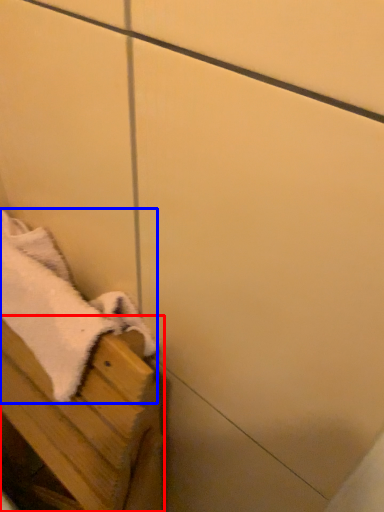
Question: Among these objects, which one is nearest to the camera, furniture (highlighted by a red box) or bath towel (highlighted by a blue box)?

Choices:
 (A) furniture
 (B) bath towel

Answer: (A)